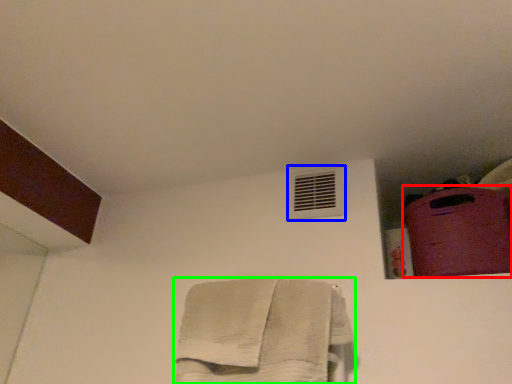
Question: Estimate the real-world distances between objects in this image. Which object is farther from luggage (highlighted by a red box), air conditioning (highlighted by a blue box) or towel (highlighted by a green box)?

Choices:
 (A) air conditioning
 (B) towel

Answer: (B)